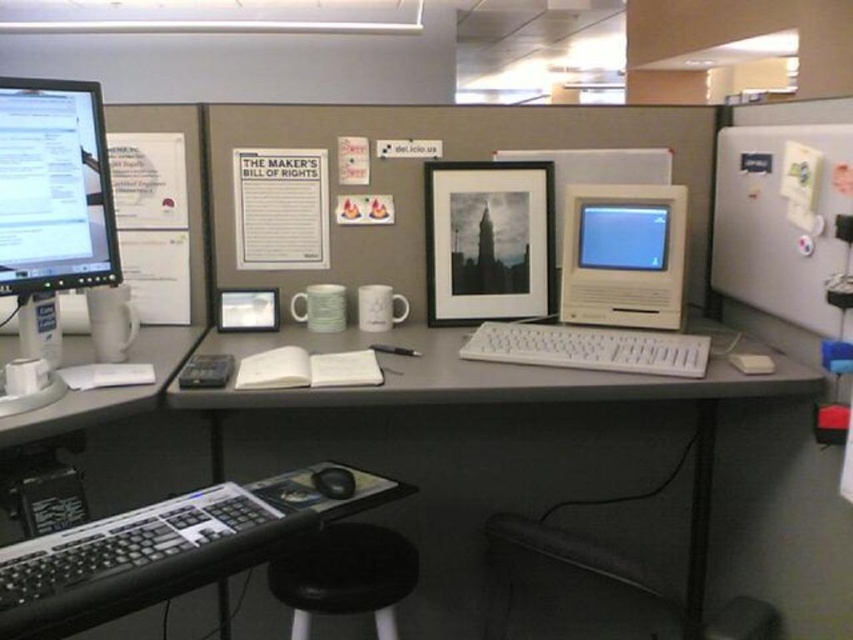
You are organizing the desk and need to place a new rectangular box that is 12 inches wide. You have two spaces available next to the black plastic keyboard at lower left and the black matte frame at center. Which space can accommodate the box based on their widths?

The black plastic keyboard at lower left might be wider than black matte frame at center, so the space next to the black plastic keyboard at lower left is more likely to accommodate the 12 inch wide box if the keyboard is indeed wider.